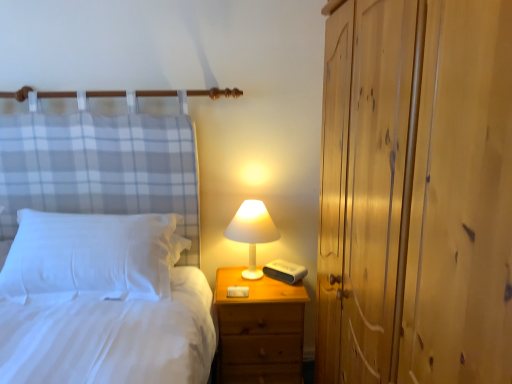
Describe the element at coordinates (88, 256) in the screenshot. The height and width of the screenshot is (384, 512). I see `white soft pillow at left` at that location.

Measure the distance between point (244, 270) and camera.

Point (244, 270) and camera are 2.26 meters apart.

This screenshot has width=512, height=384. What do you see at coordinates (259, 330) in the screenshot?
I see `wooden nightstand at right` at bounding box center [259, 330].

At what (x,y) coordinates should I click in order to perform the action: click on white soft pillow at left. Please return your answer as a coordinate pair (x, y). Looking at the image, I should click on (88, 256).

In order to click on table lamp that appears behind the wooden nightstand at right in this screenshot , I will do click(x=252, y=232).

Could you tell me if white matte table lamp at upper right is facing wooden nightstand at right?

No.

Would you say white matte table lamp at upper right is outside wooden nightstand at right?

Indeed, white matte table lamp at upper right is completely outside wooden nightstand at right.

Is wooden nightstand at right taller than white soft pillow at left?

Yes, wooden nightstand at right is taller than white soft pillow at left.

Would you say wooden nightstand at right is inside or outside white soft pillow at left?

wooden nightstand at right is located beyond the bounds of white soft pillow at left.

Is the surface of wooden nightstand at right in direct contact with white soft pillow at left?

There is a gap between wooden nightstand at right and white soft pillow at left.

Is wooden nightstand at right to the right of white soft pillow at left from the viewer's perspective?

Yes, wooden nightstand at right is to the right of white soft pillow at left.

Which is farther, (126,234) or (241,336)?

Point (241,336)

Does white soft pillow at left lie behind wooden nightstand at right?

No, the depth of white soft pillow at left is less than that of wooden nightstand at right.

Is wooden nightstand at right at the back of white soft pillow at left?

white soft pillow at left does not have its back to wooden nightstand at right.

Considering the sizes of objects white soft pillow at left and wooden nightstand at right in the image provided, who is smaller, white soft pillow at left or wooden nightstand at right?

Smaller between the two is white soft pillow at left.

Considering the relative sizes of wooden nightstand at right and white matte table lamp at upper right in the image provided, is wooden nightstand at right shorter than white matte table lamp at upper right?

No, wooden nightstand at right is not shorter than white matte table lamp at upper right.

Is wooden nightstand at right outside of white matte table lamp at upper right?

Yes, wooden nightstand at right is not within white matte table lamp at upper right.

Considering the relative positions of wooden nightstand at right and white matte table lamp at upper right in the image provided, is wooden nightstand at right to the left of white matte table lamp at upper right from the viewer's perspective?

In fact, wooden nightstand at right is to the right of white matte table lamp at upper right.

Considering the positions of points (297, 311) and (234, 221), is point (297, 311) closer to camera compared to point (234, 221)?

Yes, it is in front of point (234, 221).

Can you confirm if wooden dresser at right is positioned to the right of white matte table lamp at upper right?

Yes.

From a real-world perspective, is wooden dresser at right positioned above or below white matte table lamp at upper right?

Clearly, from a real-world perspective, wooden dresser at right is above white matte table lamp at upper right.

In terms of width, does wooden dresser at right look wider or thinner when compared to white matte table lamp at upper right?

Considering their sizes, wooden dresser at right looks broader than white matte table lamp at upper right.

Which point is more forward, (355, 47) or (249, 241)?

Positioned in front is point (355, 47).

Considering the relative positions of wooden dresser at right and wooden nightstand at right in the image provided, is wooden dresser at right in front of wooden nightstand at right?

Yes, the depth of wooden dresser at right is less than that of wooden nightstand at right.

From the image's perspective, which one is positioned higher, wooden dresser at right or wooden nightstand at right?

wooden dresser at right is shown above in the image.

Who is taller, wooden dresser at right or wooden nightstand at right?

Standing taller between the two is wooden dresser at right.

In the scene shown: Between wooden dresser at right and wooden nightstand at right, which one has smaller width?

wooden nightstand at right.

From the image's perspective, is white matte table lamp at upper right above white soft pillow at left?

Yes, from the image's perspective, white matte table lamp at upper right is over white soft pillow at left.

The image size is (512, 384). I want to click on pillow that is below the white matte table lamp at upper right (from the image's perspective), so click(x=88, y=256).

Considering the sizes of objects white matte table lamp at upper right and white soft pillow at left in the image provided, who is shorter, white matte table lamp at upper right or white soft pillow at left?

With less height is white soft pillow at left.

Is white soft pillow at left inside white matte table lamp at upper right?

No, white soft pillow at left is not a part of white matte table lamp at upper right.

This screenshot has width=512, height=384. I want to click on table lamp above the wooden nightstand at right (from the image's perspective), so click(252, 232).

Locate an element on the screen. This screenshot has height=384, width=512. pillow that is above the wooden nightstand at right (from a real-world perspective) is located at coordinates (88, 256).

Estimate the real-world distances between objects in this image. Which object is closer to wooden nightstand at right, wooden dresser at right or white soft pillow at left?

The object closer to wooden nightstand at right is white soft pillow at left.

From the image, which object appears to be nearer to white soft pillow at left, white matte table lamp at upper right or wooden dresser at right?

white matte table lamp at upper right is closer to white soft pillow at left.

Based on their spatial positions, is wooden nightstand at right or white soft pillow at left closer to white matte table lamp at upper right?

wooden nightstand at right is closer to white matte table lamp at upper right.

From the image, which object appears to be farther from wooden dresser at right, white matte table lamp at upper right or wooden nightstand at right?

The object further to wooden dresser at right is white matte table lamp at upper right.

Which object lies further to the anchor point white soft pillow at left, wooden dresser at right or white matte table lamp at upper right?

wooden dresser at right.

Which object lies nearer to the anchor point wooden nightstand at right, wooden dresser at right or white matte table lamp at upper right?

white matte table lamp at upper right is positioned closer to the anchor wooden nightstand at right.

When comparing their distances from wooden dresser at right, does white soft pillow at left or white matte table lamp at upper right seem closer?

white matte table lamp at upper right is closer to wooden dresser at right.

From the image, which object appears to be farther from wooden nightstand at right, white soft pillow at left or white matte table lamp at upper right?

white soft pillow at left is positioned further to the anchor wooden nightstand at right.

At what (x,y) coordinates should I click in order to perform the action: click on pillow positioned between wooden dresser at right and white matte table lamp at upper right from near to far. Please return your answer as a coordinate pair (x, y). Looking at the image, I should click on (88, 256).

Where is `nightstand between wooden dresser at right and white matte table lamp at upper right along the z-axis`? nightstand between wooden dresser at right and white matte table lamp at upper right along the z-axis is located at coordinates (259, 330).

The width and height of the screenshot is (512, 384). What are the coordinates of `table lamp between white soft pillow at left and wooden nightstand at right from left to right` in the screenshot? It's located at (252, 232).

At what (x,y) coordinates should I click in order to perform the action: click on pillow positioned between wooden dresser at right and wooden nightstand at right from near to far. Please return your answer as a coordinate pair (x, y). This screenshot has width=512, height=384. Looking at the image, I should click on (88, 256).